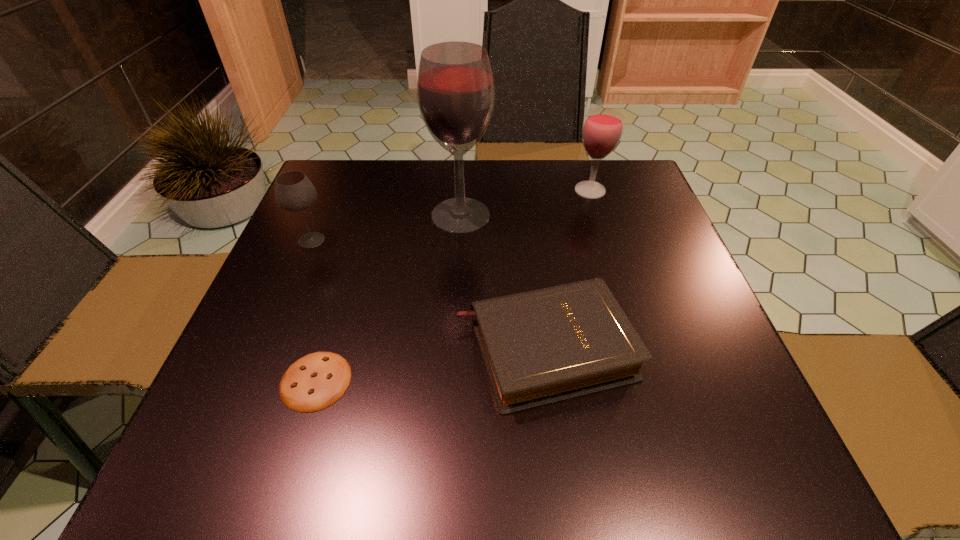
The height and width of the screenshot is (540, 960). Identify the location of vacant area at the far edge. tap(451, 187).

In the image, there is a desktop. Find the location of `vacant space at the near edge`. vacant space at the near edge is located at coordinates (316, 443).

This screenshot has height=540, width=960. In the image, there is a desktop. Find the location of `blank space at the left edge`. blank space at the left edge is located at coordinates (227, 393).

Locate an element on the screen. vacant region at the right edge of the desktop is located at coordinates (657, 279).

At what (x,y) coordinates should I click in order to perform the action: click on vacant space at the far left corner. Please return your answer as a coordinate pair (x, y). Looking at the image, I should click on (361, 188).

Find the location of a particular element. Image resolution: width=960 pixels, height=540 pixels. free space at the near left corner is located at coordinates (253, 475).

Identify the location of vacant space at the near right corner of the desktop. (703, 450).

You are a GUI agent. You are given a task and a screenshot of the screen. Output one action in this format:
    pyautogui.click(x=<x>, y=<y>)
    Task: Click on the vacant area between the fourth tallest object and the shortest object
    The width and height of the screenshot is (960, 540).
    Given the screenshot: What is the action you would take?
    pyautogui.click(x=430, y=364)

You are a GUI agent. You are given a task and a screenshot of the screen. Output one action in this format:
    pyautogui.click(x=<x>, y=<y>)
    Task: Click on the free spot between the Bible and the taller wineglass
    The image size is (960, 540).
    Given the screenshot: What is the action you would take?
    pos(567,269)

Locate an element on the screen. This screenshot has width=960, height=540. unoccupied area between the tallest object and the shortest object is located at coordinates (388, 298).